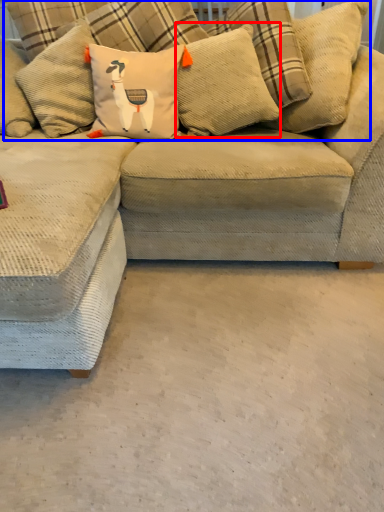
Question: Which object is further to the camera taking this photo, pillow (highlighted by a red box) or pillow (highlighted by a blue box)?

Choices:
 (A) pillow
 (B) pillow

Answer: (A)